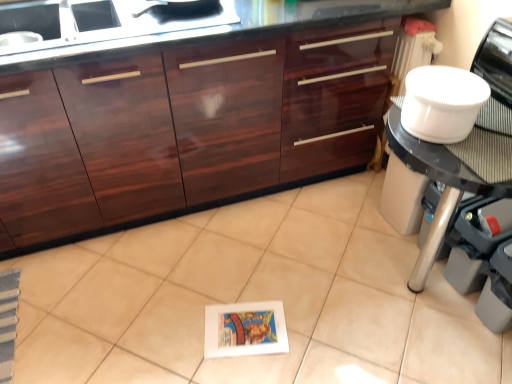
Locate an element on the screen. spots to the right of white paper book at center is located at coordinates (313, 328).